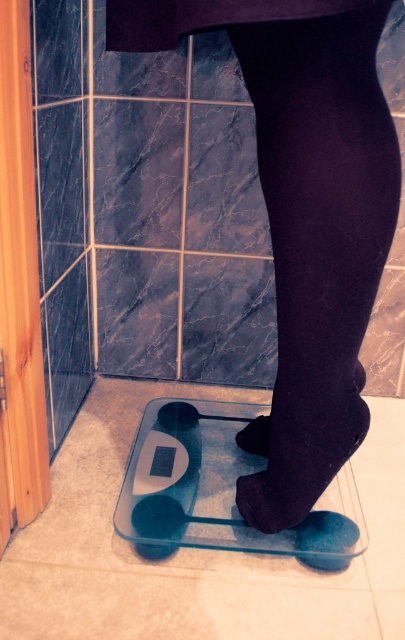
Question: Does black velvet tights at lower center appear on the right side of matte black shoe at center?

Choices:
 (A) no
 (B) yes

Answer: (B)

Question: Which point is closer to the camera?

Choices:
 (A) (326, 433)
 (B) (300, 346)

Answer: (B)

Question: Is matte black boot at center to the right of matte black shoe at center from the viewer's perspective?

Choices:
 (A) yes
 (B) no

Answer: (A)

Question: Is black velvet tights at lower center wider than matte black boot at center?

Choices:
 (A) yes
 (B) no

Answer: (A)

Question: Among these points, which one is nearest to the camera?

Choices:
 (A) (277, 102)
 (B) (260, 451)
 (C) (247, 509)

Answer: (A)

Question: Among these objects, which one is farthest from the camera?

Choices:
 (A) black velvet tights at lower center
 (B) matte black shoe at center
 (C) matte black boot at center

Answer: (B)